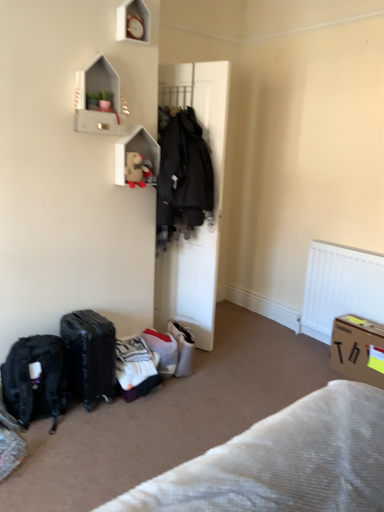
Question: Is white textured blanket at lower right bigger than fluffy beige plush at upper center?

Choices:
 (A) no
 (B) yes

Answer: (B)

Question: From the image's perspective, is white textured blanket at lower right on fluffy beige plush at upper center?

Choices:
 (A) no
 (B) yes

Answer: (A)

Question: Could you tell me if white textured blanket at lower right is turned towards fluffy beige plush at upper center?

Choices:
 (A) no
 (B) yes

Answer: (A)

Question: From a real-world perspective, is white textured blanket at lower right located higher than fluffy beige plush at upper center?

Choices:
 (A) yes
 (B) no

Answer: (B)

Question: Is the position of white textured blanket at lower right less distant than that of fluffy beige plush at upper center?

Choices:
 (A) no
 (B) yes

Answer: (B)

Question: Relative to white textured blanket at lower right, is cardboard box at lower right in front or behind?

Choices:
 (A) behind
 (B) front

Answer: (A)

Question: Is cardboard box at lower right bigger or smaller than white textured blanket at lower right?

Choices:
 (A) small
 (B) big

Answer: (A)

Question: Considering the positions of point (344, 342) and point (374, 501), is point (344, 342) closer or farther from the camera than point (374, 501)?

Choices:
 (A) farther
 (B) closer

Answer: (A)

Question: In terms of height, does cardboard box at lower right look taller or shorter compared to white textured blanket at lower right?

Choices:
 (A) short
 (B) tall

Answer: (B)

Question: From the image's perspective, is white matte wooden shelf at upper center, the first shelf ordered from the bottom, located above or below black matte suitcase at lower left?

Choices:
 (A) above
 (B) below

Answer: (A)

Question: Relative to black matte suitcase at lower left, is white matte wooden shelf at upper center, the 2th shelf positioned from the top, in front or behind?

Choices:
 (A) front
 (B) behind

Answer: (B)

Question: Visually, is white matte wooden shelf at upper center, the first shelf ordered from the bottom, positioned to the left or to the right of black matte suitcase at lower left?

Choices:
 (A) right
 (B) left

Answer: (A)

Question: Is point (122, 183) positioned closer to the camera than point (96, 353)?

Choices:
 (A) closer
 (B) farther

Answer: (B)

Question: Does point (140, 170) appear closer or farther from the camera than point (66, 374)?

Choices:
 (A) farther
 (B) closer

Answer: (A)

Question: Relative to black matte backpack at lower left, is fluffy beige plush at upper center in front or behind?

Choices:
 (A) behind
 (B) front

Answer: (A)